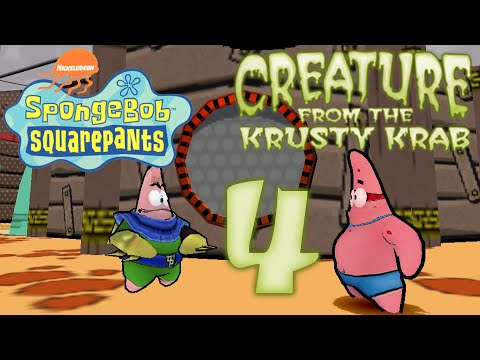
Identify the location of brown floor. This screenshot has height=360, width=480. (211, 308).